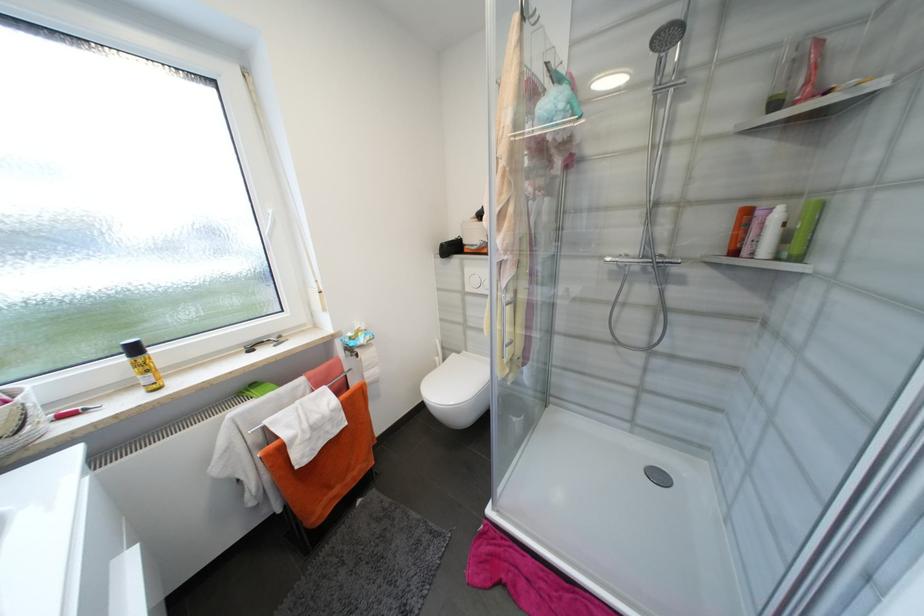
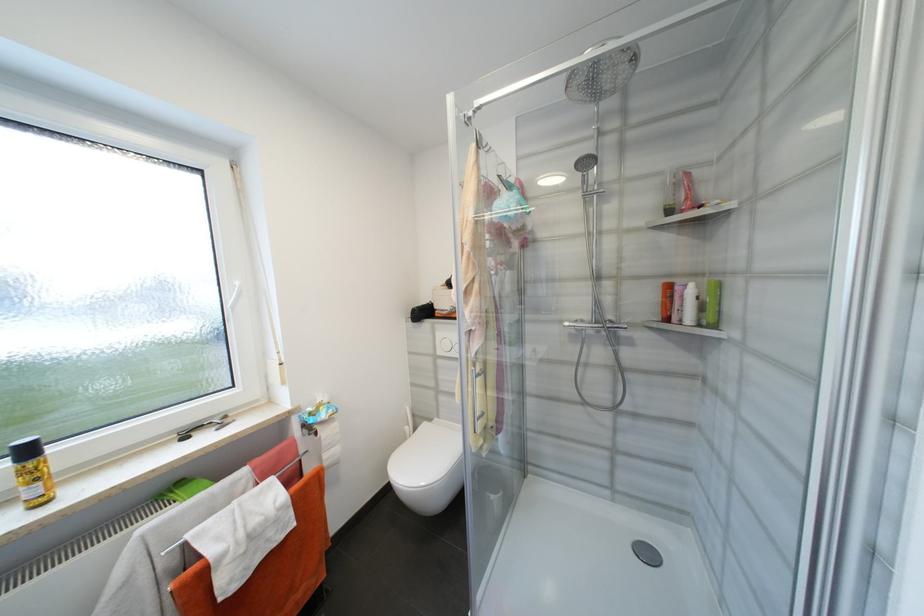
Question: I am providing you with two images of the same scene from different viewpoints. Please identify which objects are invisible in image2.

Choices:
 (A) metal nail clipper
 (B) toilet paper roll
 (C) white window handle
 (D) none of these

Answer: (D)